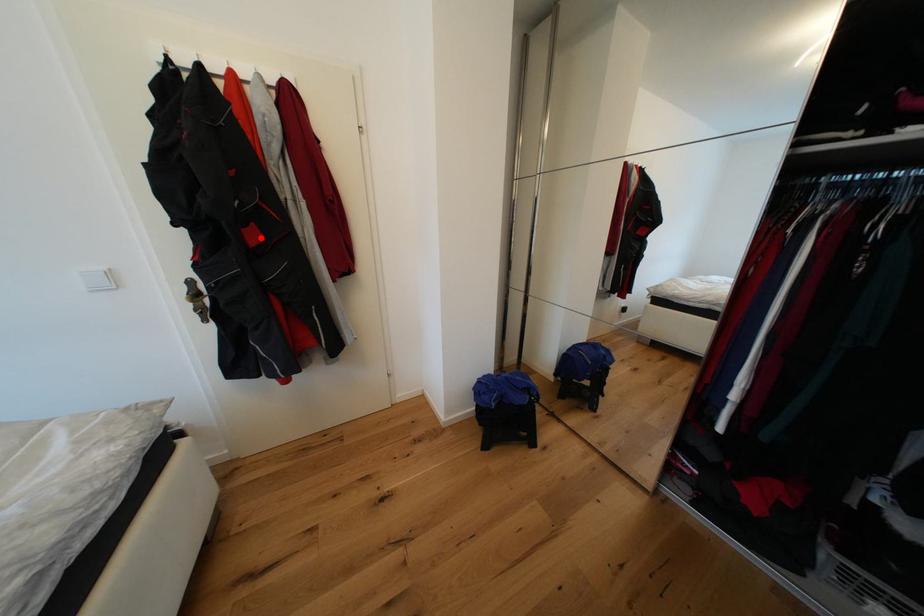
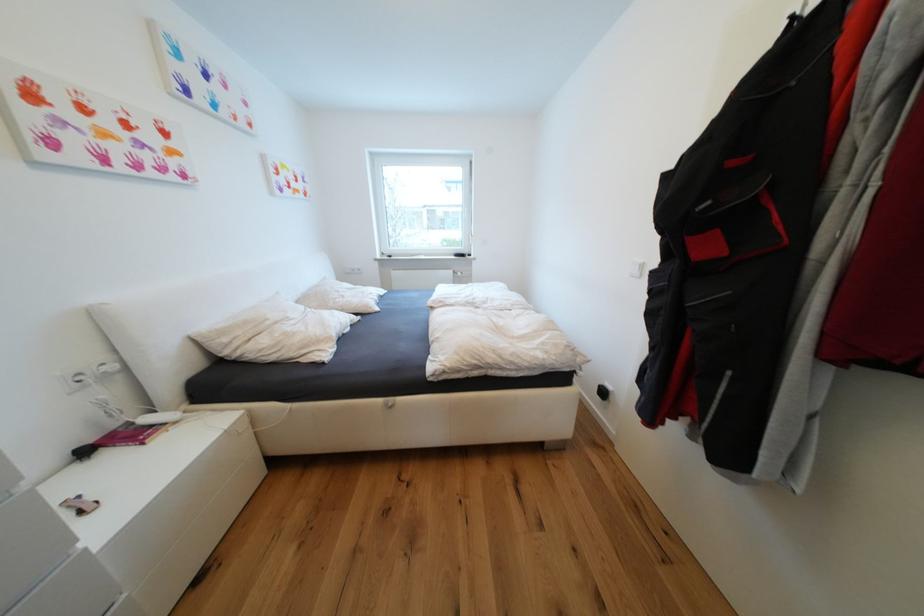
In the second image, find the point that corresponds to the highlighted location in the first image.

(714, 249)